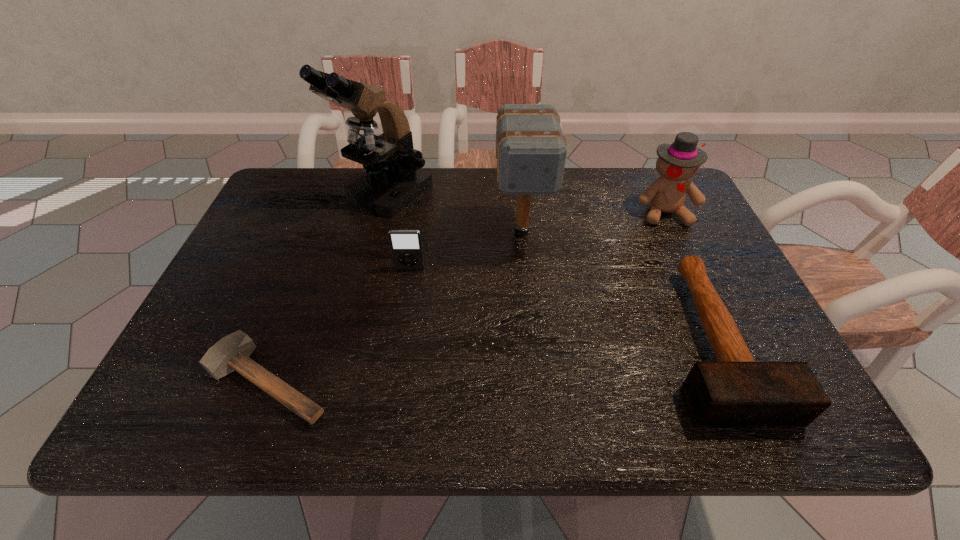
Find the location of `free location located 0.290m on the front of the microscope`. free location located 0.290m on the front of the microscope is located at coordinates (360, 309).

At what (x,y) coordinates should I click in order to perform the action: click on free space located 0.120m on the striking surface of the fifth shortest object. Please return your answer as a coordinate pair (x, y). Looking at the image, I should click on (528, 294).

You are a GUI agent. You are given a task and a screenshot of the screen. Output one action in this format:
    pyautogui.click(x=<x>, y=<y>)
    Task: Click on the free space located 0.260m on the front-facing side of the rag_doll
    
    Given the screenshot: What is the action you would take?
    pyautogui.click(x=706, y=300)

Find the location of `free region located on the front-facing side of the third shortest object`. free region located on the front-facing side of the third shortest object is located at coordinates (395, 368).

You are a GUI agent. You are given a task and a screenshot of the screen. Output one action in this format:
    pyautogui.click(x=<x>, y=<y>)
    Task: Click on the free space located on the right of the leftmost mallet
    The image size is (960, 540).
    Given the screenshot: What is the action you would take?
    pyautogui.click(x=426, y=381)

At what (x,y) coordinates should I click in order to perform the action: click on microscope situated at the far edge. Please return your answer as a coordinate pair (x, y). The image size is (960, 540). Looking at the image, I should click on (394, 177).

The image size is (960, 540). Identify the location of mallet located at the far edge. tap(531, 150).

Where is `rag_doll that is at the far edge`? Image resolution: width=960 pixels, height=540 pixels. rag_doll that is at the far edge is located at coordinates (677, 162).

Locate an element on the screen. This screenshot has width=960, height=540. object present at the left edge is located at coordinates (232, 352).

I want to click on rag_doll that is at the right edge, so click(x=677, y=162).